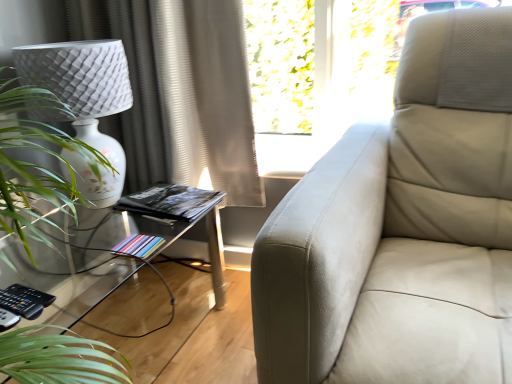
Question: Considering the relative sizes of beige textured curtain at upper left and pastel paper book at lower left, the 2th book viewed from the back, in the image provided, is beige textured curtain at upper left taller than pastel paper book at lower left, the 2th book viewed from the back,?

Choices:
 (A) no
 (B) yes

Answer: (B)

Question: Is beige textured curtain at upper left oriented towards pastel paper book at lower left, which appears as the 1th book when viewed from the front?

Choices:
 (A) yes
 (B) no

Answer: (A)

Question: From the image's perspective, would you say beige textured curtain at upper left is positioned over pastel paper book at lower left, marked as the second book in a top-to-bottom arrangement?

Choices:
 (A) no
 (B) yes

Answer: (B)

Question: Is beige textured curtain at upper left wider than pastel paper book at lower left, marked as the second book in a top-to-bottom arrangement?

Choices:
 (A) no
 (B) yes

Answer: (B)

Question: From a real-world perspective, is beige textured curtain at upper left physically above pastel paper book at lower left, the 2th book viewed from the back?

Choices:
 (A) no
 (B) yes

Answer: (B)

Question: Considering the positions of beige textured curtain at upper left and green leafy plant at left in the image, is beige textured curtain at upper left taller or shorter than green leafy plant at left?

Choices:
 (A) tall
 (B) short

Answer: (A)

Question: From the image's perspective, is beige textured curtain at upper left positioned above or below green leafy plant at left?

Choices:
 (A) above
 (B) below

Answer: (A)

Question: Visually, is beige textured curtain at upper left positioned to the left or to the right of green leafy plant at left?

Choices:
 (A) right
 (B) left

Answer: (A)

Question: Choose the correct answer: Is beige textured curtain at upper left inside green leafy plant at left or outside it?

Choices:
 (A) inside
 (B) outside

Answer: (B)

Question: Relative to black matte book at center, positioned as the first book in top-to-bottom order, is beige textured curtain at upper left in front or behind?

Choices:
 (A) front
 (B) behind

Answer: (A)

Question: From a real-world perspective, is beige textured curtain at upper left positioned above or below black matte book at center, arranged as the 2th book when ordered from the bottom?

Choices:
 (A) above
 (B) below

Answer: (A)

Question: Considering the positions of beige textured curtain at upper left and black matte book at center, positioned as the first book in top-to-bottom order, in the image, is beige textured curtain at upper left bigger or smaller than black matte book at center, positioned as the first book in top-to-bottom order,?

Choices:
 (A) small
 (B) big

Answer: (B)

Question: Does point (225, 140) appear closer or farther from the camera than point (190, 196)?

Choices:
 (A) farther
 (B) closer

Answer: (A)

Question: Is pastel paper book at lower left, marked as the second book in a top-to-bottom arrangement, inside the boundaries of black matte book at center, positioned as the first book in top-to-bottom order, or outside?

Choices:
 (A) inside
 (B) outside

Answer: (B)

Question: Based on their positions, is pastel paper book at lower left, marked as the second book in a top-to-bottom arrangement, located to the left or right of black matte book at center, positioned as the first book in top-to-bottom order?

Choices:
 (A) right
 (B) left

Answer: (B)